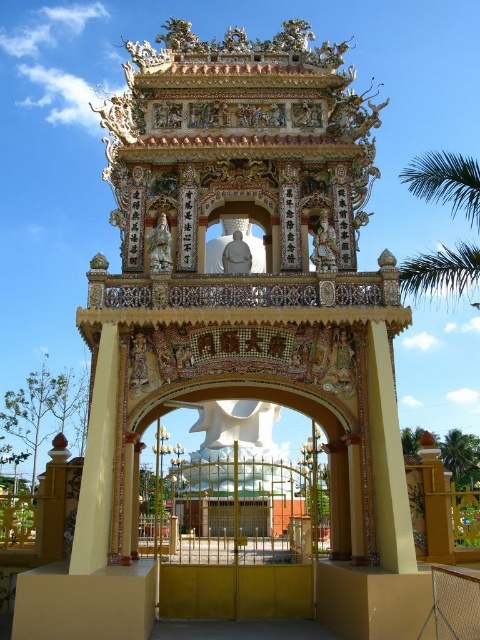
Does green leafy palm tree at upper right appear over green leafy palm tree at right?

Yes.

Who is shorter, green leafy palm tree at upper right or green leafy palm tree at right?

With less height is green leafy palm tree at right.

Identify the location of green leafy palm tree at upper right. pos(445,180).

This screenshot has height=640, width=480. I want to click on green leafy palm tree at upper right, so click(445, 180).